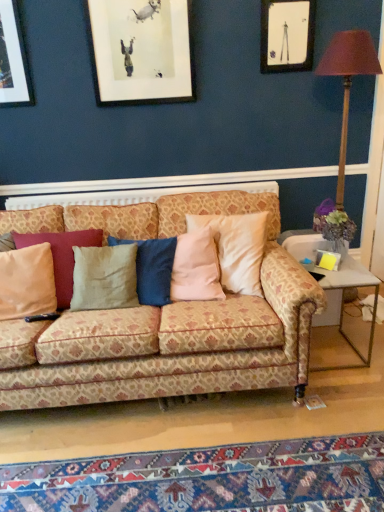
Image resolution: width=384 pixels, height=512 pixels. I want to click on empty space that is to the right of metal/glass side table at lower right, so click(365, 344).